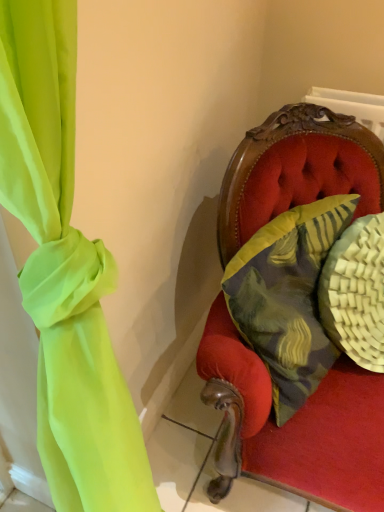
Question: Should I look upward or downward to see textured yellow pillow at right?

Choices:
 (A) up
 (B) down

Answer: (B)